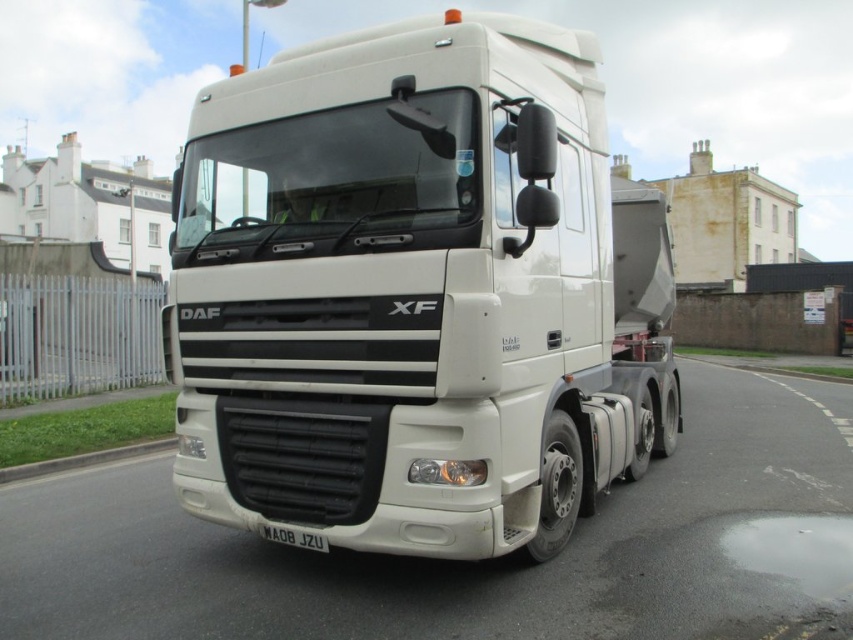
You are a delivery driver who needs to ensure that the license plate on the truck is visible for identification. Given the current positioning of the white matte trailer truck at center and the white matte license plate at center, is the license plate obstructed by the trailer?

The white matte trailer truck at center is positioned over white matte license plate at center, so the license plate is obstructed by the trailer and not visible.

You are standing on the sidewalk next to the metal fence and want to take a photo of the truck. You notice two points marked on the truck. Which point is closer to you, point at coordinate (537, 189) or point at coordinate (308, 547)?

Point at coordinate (537, 189) is closer to you than point at coordinate (308, 547).